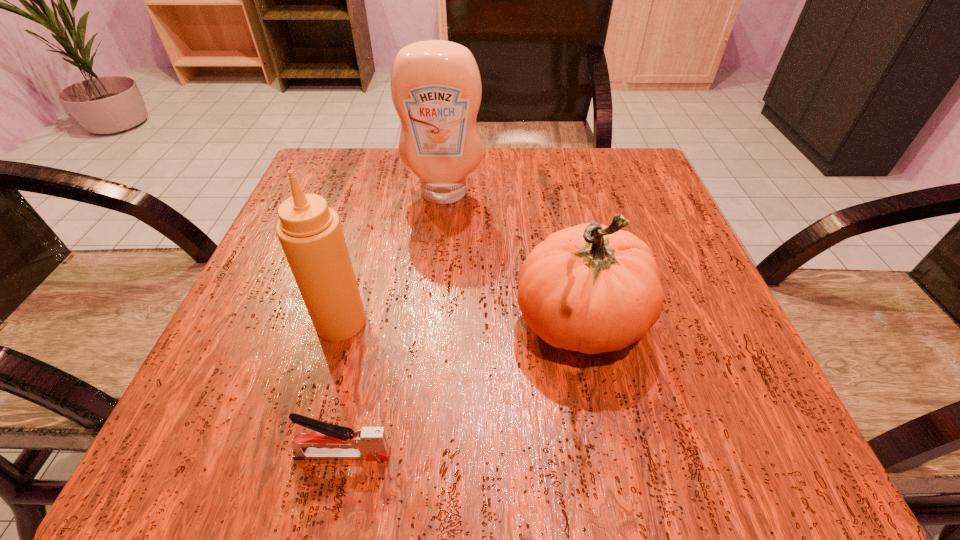
This screenshot has width=960, height=540. Find the location of `vacant space that is in between the rightmost object and the nearest object`. vacant space that is in between the rightmost object and the nearest object is located at coordinates (462, 390).

You are a GUI agent. You are given a task and a screenshot of the screen. Output one action in this format:
    pyautogui.click(x=<x>, y=<y>)
    Task: Click on the third closest object relative to the shortest object
    The height and width of the screenshot is (540, 960).
    Given the screenshot: What is the action you would take?
    pyautogui.click(x=436, y=89)

Choose which object is the second nearest neighbor to the pumpkin. Please provide its 2D coordinates. Your answer should be formatted as a tuple, i.e. [(x, y)], where the tuple contains the x and y coordinates of a point satisfying the conditions above.

[(436, 89)]

Where is `free space that satisfies the following two spatial constraints: 1. on the label of the right condiment; 2. on the handle side of the stapler`? The height and width of the screenshot is (540, 960). free space that satisfies the following two spatial constraints: 1. on the label of the right condiment; 2. on the handle side of the stapler is located at coordinates (417, 455).

Where is `free region that satisfies the following two spatial constraints: 1. on the label of the farthest object; 2. on the left side of the pumpkin`? The height and width of the screenshot is (540, 960). free region that satisfies the following two spatial constraints: 1. on the label of the farthest object; 2. on the left side of the pumpkin is located at coordinates (430, 326).

I want to click on vacant area that satisfies the following two spatial constraints: 1. on the label of the pumpkin; 2. on the right side of the farther condiment, so click(x=430, y=326).

The image size is (960, 540). In order to click on blank space that satisfies the following two spatial constraints: 1. on the label of the farthest object; 2. on the handle side of the shortest object in this screenshot , I will do `click(417, 455)`.